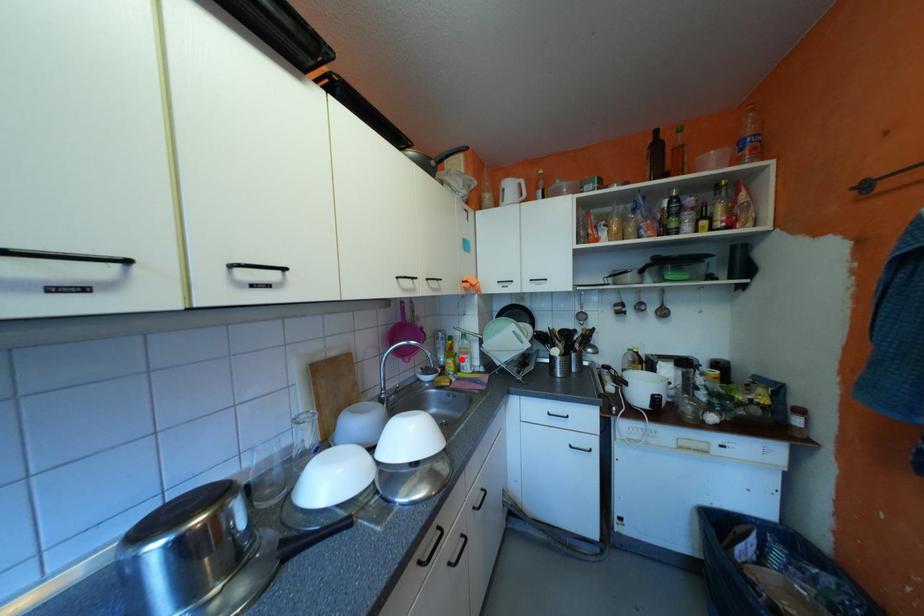
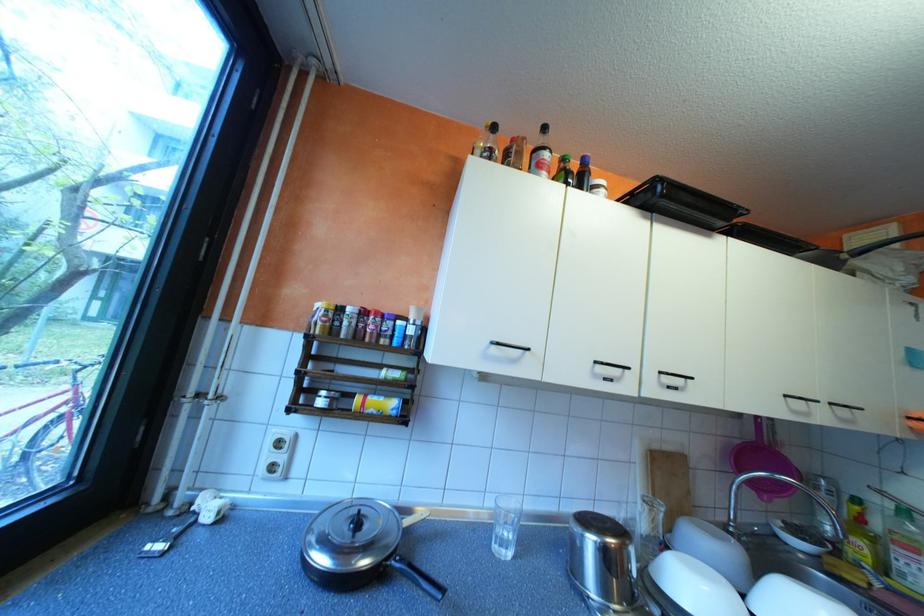
Where in the second image is the point corresponding to the highlighted location from the first image?

(871, 541)